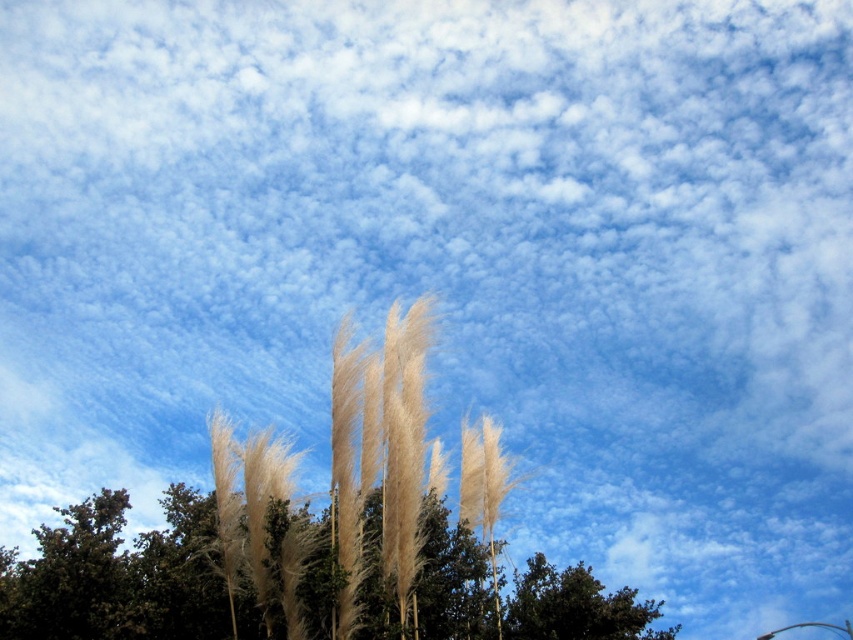
Is point (126, 561) more distant than point (618, 604)?

That is False.

Is silvery grass at center positioned at the back of dark green leafy tree at lower center?

No, silvery grass at center is in front of dark green leafy tree at lower center.

Does point (1, 593) come behind point (523, 614)?

That is False.

This screenshot has width=853, height=640. Identify the location of silvery grass at center. (119, 573).